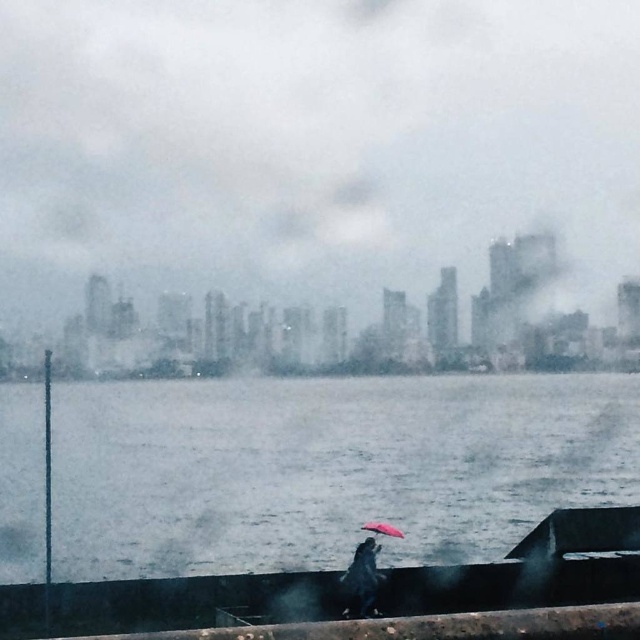
Question: Does transparent glass skyscrapers at center have a lesser width compared to matte pink umbrella at center?

Choices:
 (A) no
 (B) yes

Answer: (A)

Question: Which is farther from the shiny black umbrella at lower center?

Choices:
 (A) gray matte water at lower center
 (B) matte pink umbrella at center

Answer: (A)

Question: Is gray matte water at lower center to the right of shiny black umbrella at lower center from the viewer's perspective?

Choices:
 (A) yes
 (B) no

Answer: (B)

Question: Is gray matte water at lower center below shiny black umbrella at lower center?

Choices:
 (A) yes
 (B) no

Answer: (A)

Question: Which object appears farthest from the camera in this image?

Choices:
 (A) matte pink umbrella at center
 (B) shiny black umbrella at lower center
 (C) transparent glass skyscrapers at center

Answer: (C)

Question: Which of the following is the closest to the observer?

Choices:
 (A) (400, 538)
 (B) (134, 182)

Answer: (A)